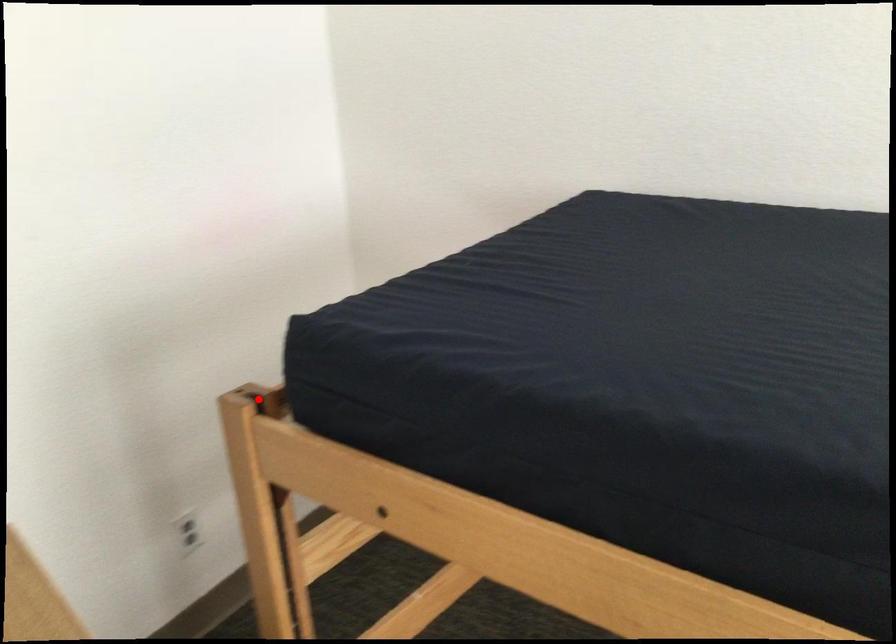
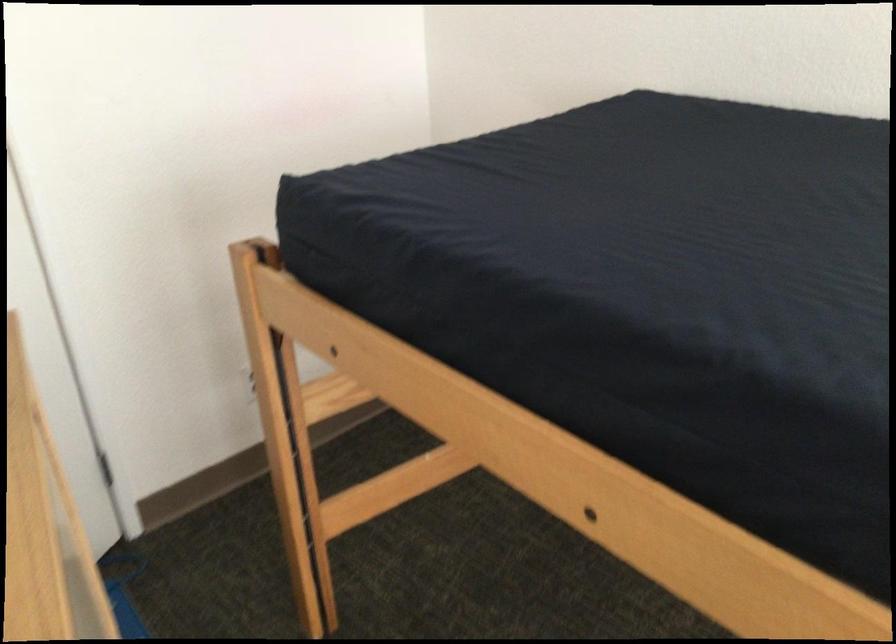
Question: A red point is marked in image1. In image2, is the corresponding 3D point closer to the camera or farther? Reply with the corresponding letter.

Choices:
 (A) The corresponding 3D point is closer.
 (B) The corresponding 3D point is farther.

Answer: (B)